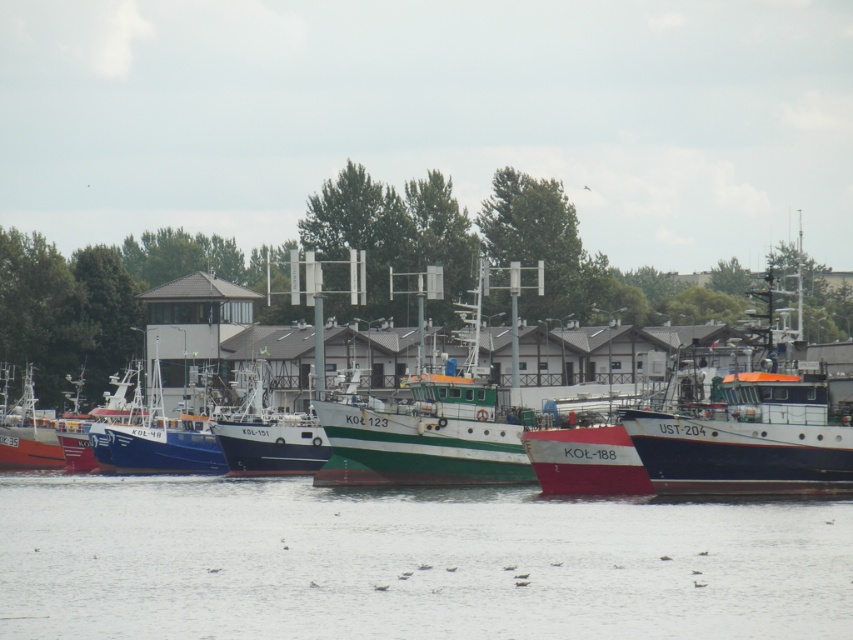
Can you confirm if clear water at center is bigger than blue matte boat at center?

Yes.

Between clear water at center and blue matte boat at center, which one appears on the left side from the viewer's perspective?

Positioned to the left is blue matte boat at center.

Who is more forward, (549, 500) or (189, 461)?

Positioned in front is point (549, 500).

Where is `clear water at center`? clear water at center is located at coordinates (408, 563).

Measure the distance between point (122,609) and camera.

80.07 meters

This screenshot has height=640, width=853. What are the coordinates of `clear water at center` in the screenshot? It's located at (408, 563).

Does point (396, 499) lie in front of point (273, 440)?

Yes.

The height and width of the screenshot is (640, 853). I want to click on clear water at center, so click(408, 563).

Does green matte boat at center have a lesser height compared to blue matte boat at center?

No.

Is green matte boat at center further to camera compared to blue matte boat at center?

No, it is not.

Is point (379, 480) positioned behind point (141, 470)?

No, it is not.

Locate an element on the screen. green matte boat at center is located at coordinates (430, 428).